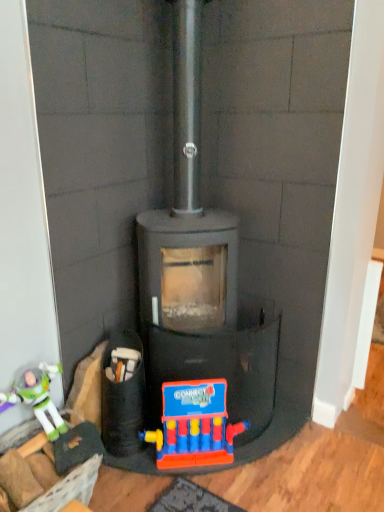
At what (x,y) coordinates should I click in order to perform the action: click on vacant region to the right of blue plastic connect four at lower center. Please return your answer as a coordinate pair (x, y). This screenshot has height=512, width=384. Looking at the image, I should click on (276, 465).